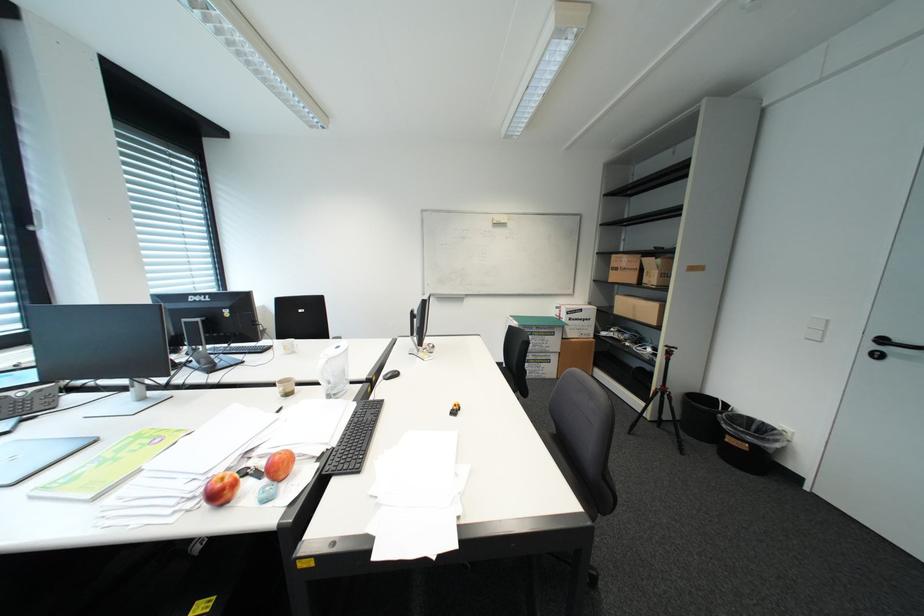
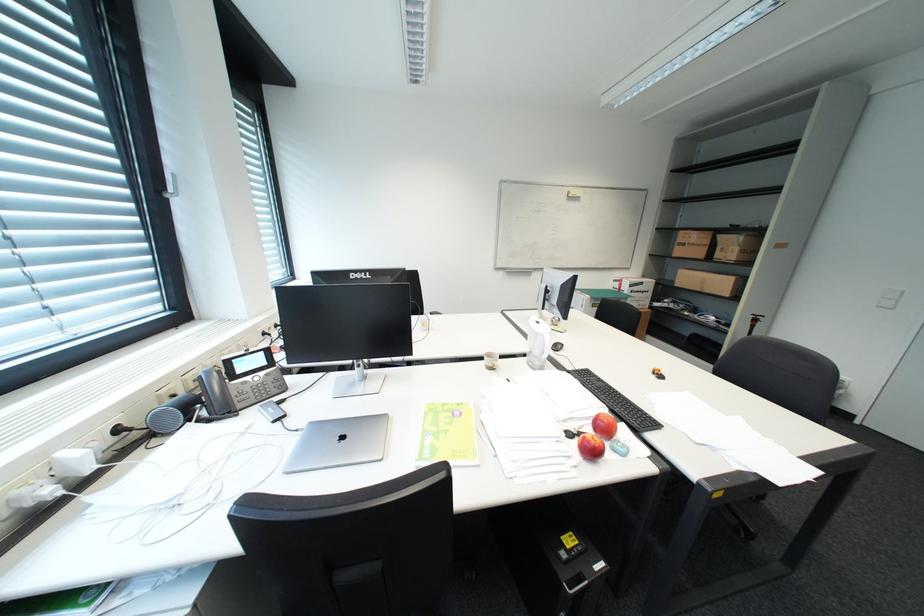
Question: Which direction would the cameraman need to move to produce the second image? Reply with the corresponding letter.

Choices:
 (A) Left
 (B) Right
 (C) Forward
 (D) Backward

Answer: (A)